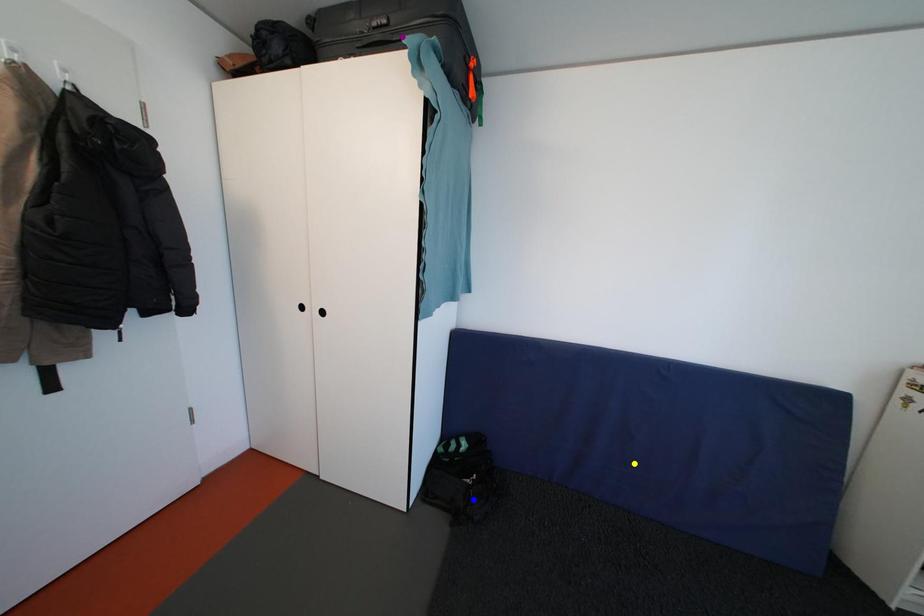
Order these from nearest to farthest:
A) blue point
B) yellow point
C) purple point

yellow point
purple point
blue point